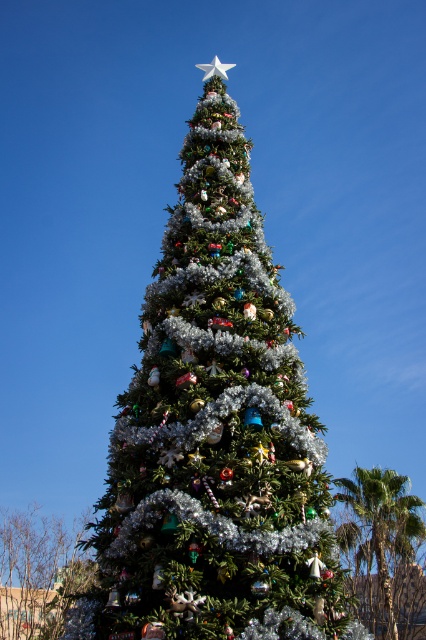
Does green textured christmas tree at center appear on the right side of white metallic star at top?

Indeed, green textured christmas tree at center is positioned on the right side of white metallic star at top.

Is green textured christmas tree at center to the left of white metallic star at top from the viewer's perspective?

Incorrect, green textured christmas tree at center is not on the left side of white metallic star at top.

The width and height of the screenshot is (426, 640). I want to click on green textured christmas tree at center, so click(215, 435).

This screenshot has width=426, height=640. Identify the location of green textured christmas tree at center. (215, 435).

Is green textured christmas tree at center above green shiny christmas tree at lower left?

Correct, green textured christmas tree at center is located above green shiny christmas tree at lower left.

Does point (120, 576) lie in front of point (16, 556)?

Yes.

Identify the location of green textured christmas tree at center. (215, 435).

You are a GUI agent. You are given a task and a screenshot of the screen. Output one action in this format:
    pyautogui.click(x=<x>, y=<y>)
    Task: Click on the green textured christmas tree at center
    The image size is (426, 640).
    Given the screenshot: What is the action you would take?
    pyautogui.click(x=215, y=435)

Is green leafy palm at lower right above white metallic star at top?

Incorrect, green leafy palm at lower right is not positioned above white metallic star at top.

Does green leafy palm at lower right come in front of white metallic star at top?

That is False.

You are a GUI agent. You are given a task and a screenshot of the screen. Output one action in this format:
    pyautogui.click(x=<x>, y=<y>)
    Task: Click on the green leafy palm at lower right
    
    Given the screenshot: What is the action you would take?
    pyautogui.click(x=380, y=532)